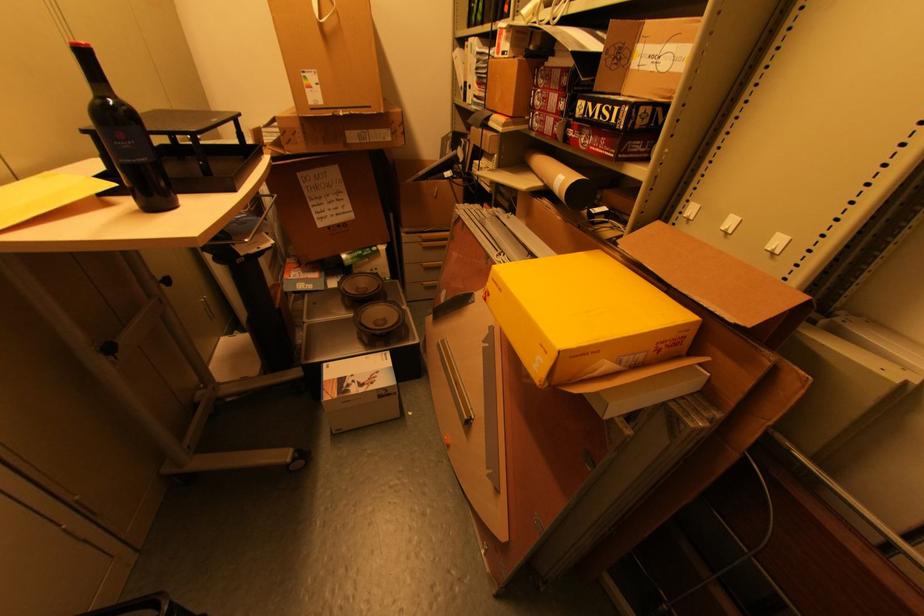
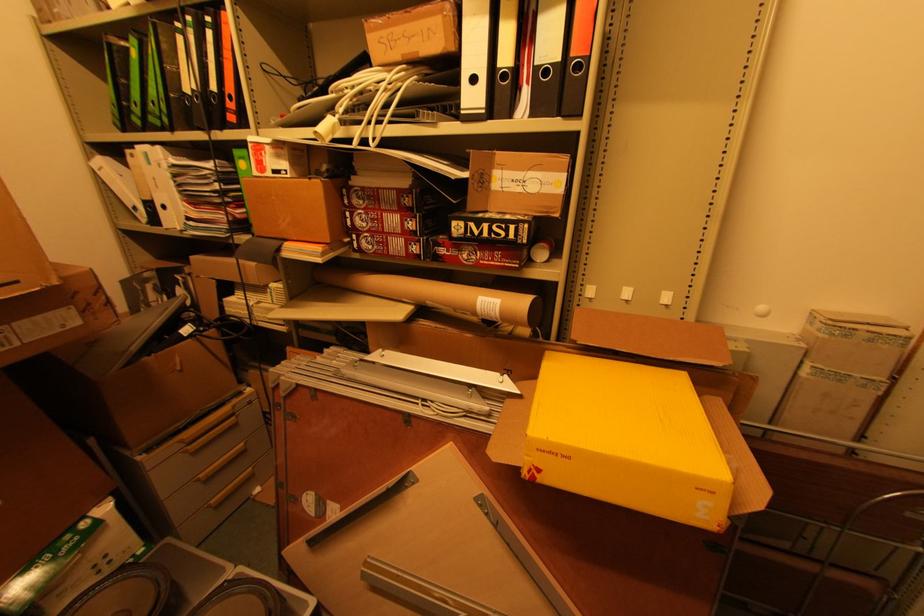
Question: How did the camera likely rotate?

Choices:
 (A) Left
 (B) Right
 (C) Up
 (D) Down

Answer: (B)